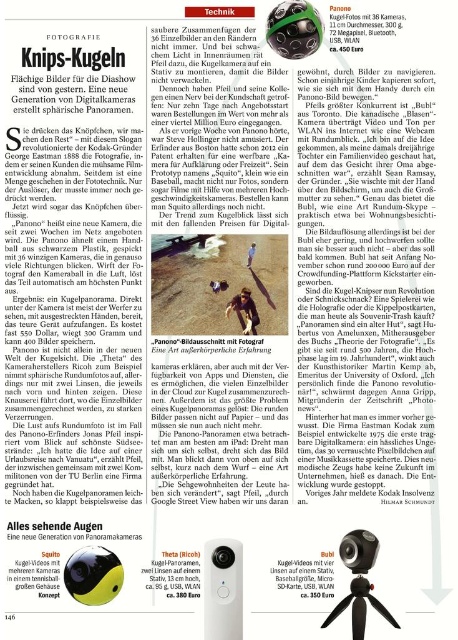
Question: Which is farther from the white plastic kugel-kamera at center?

Choices:
 (A) black plastic tripod at lower center
 (B) black plastic webcam at center

Answer: (B)

Question: Among these objects, which one is nearest to the camera?

Choices:
 (A) black plastic webcam at center
 (B) white plastic kugel-kamera at center
 (C) black plastic tripod at lower center

Answer: (C)

Question: Does black plastic tripod at lower center have a lesser width compared to black plastic webcam at center?

Choices:
 (A) yes
 (B) no

Answer: (B)

Question: Does white plastic kugel-kamera at center lie behind black plastic webcam at center?

Choices:
 (A) no
 (B) yes

Answer: (A)

Question: Does white plastic kugel-kamera at center lie in front of black plastic tripod at lower center?

Choices:
 (A) yes
 (B) no

Answer: (B)

Question: Considering the real-world distances, which object is closest to the black plastic tripod at lower center?

Choices:
 (A) black plastic webcam at center
 (B) white plastic kugel-kamera at center

Answer: (A)